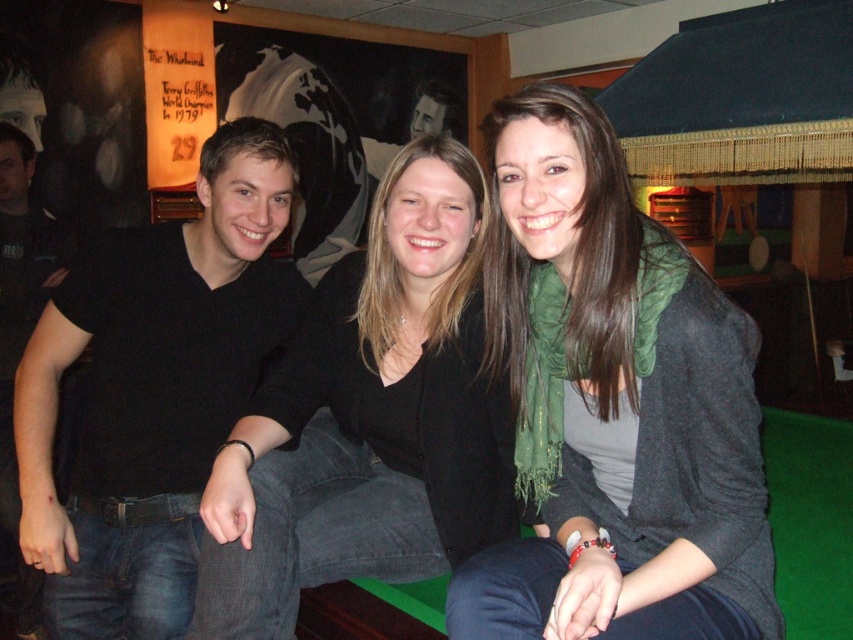
Question: Observing the image, what is the correct spatial positioning of green scarf at center in reference to black matte shirt at center?

Choices:
 (A) left
 (B) right

Answer: (B)

Question: Which point appears closest to the camera in this image?

Choices:
 (A) (422, 268)
 (B) (570, 602)

Answer: (B)

Question: Does green scarf at center have a lesser width compared to black matte shirt at center?

Choices:
 (A) yes
 (B) no

Answer: (A)

Question: Which of the following is the closest to the observer?

Choices:
 (A) (349, 392)
 (B) (686, 342)

Answer: (B)

Question: Can you confirm if green scarf at center is positioned above black matte shirt at center?

Choices:
 (A) no
 (B) yes

Answer: (B)